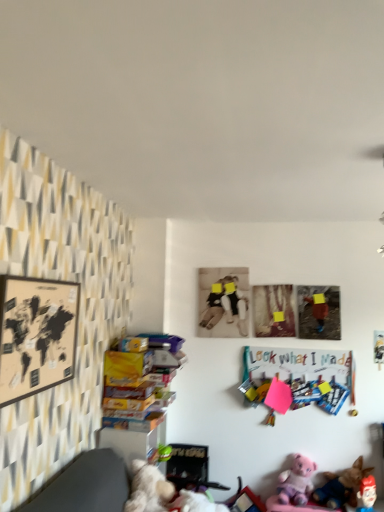
Question: From a real-world perspective, is pink plush bear at lower right, the 1th toy viewed from the back, physically below fluffy white teddy bear at lower center, acting as the 1th toy starting from the front?

Choices:
 (A) yes
 (B) no

Answer: (A)

Question: Is pink plush bear at lower right, the 1th toy viewed from the back, further to camera compared to fluffy white teddy bear at lower center, which is the 4th toy in back-to-front order?

Choices:
 (A) yes
 (B) no

Answer: (A)

Question: Is the position of pink plush bear at lower right, which appears as the fourth toy when viewed from the front, less distant than that of fluffy white teddy bear at lower center, the 1th toy when ordered from left to right?

Choices:
 (A) no
 (B) yes

Answer: (A)

Question: Can you confirm if pink plush bear at lower right, which is the 2th toy from left to right, is bigger than fluffy white teddy bear at lower center, which is the 4th toy in back-to-front order?

Choices:
 (A) no
 (B) yes

Answer: (A)

Question: From the image's perspective, does pink plush bear at lower right, the 1th toy viewed from the back, appear lower than fluffy white teddy bear at lower center, acting as the 1th toy starting from the front?

Choices:
 (A) yes
 (B) no

Answer: (A)

Question: Is fluffy white teddy bear at lower center, which is the 4th toy in back-to-front order, a part of pink plush bear at lower right, acting as the 3th toy starting from the right?

Choices:
 (A) no
 (B) yes

Answer: (A)

Question: From the image's perspective, is matte plastic picture frame at upper right, the 3th picture frame in the left-to-right sequence, above wooden map at left, which ranks as the first picture frame in front-to-back order?

Choices:
 (A) no
 (B) yes

Answer: (A)

Question: Is matte plastic picture frame at upper right, the 3th picture frame in the left-to-right sequence, to the left of wooden map at left, which ranks as the first picture frame in front-to-back order, from the viewer's perspective?

Choices:
 (A) no
 (B) yes

Answer: (A)

Question: Is matte plastic picture frame at upper right, the 3th picture frame in the left-to-right sequence, positioned before wooden map at left, the 3th picture frame positioned from the right?

Choices:
 (A) yes
 (B) no

Answer: (B)

Question: Does matte plastic picture frame at upper right, the first picture frame viewed from the right, have a lesser width compared to wooden map at left, the 3th picture frame positioned from the back?

Choices:
 (A) no
 (B) yes

Answer: (A)

Question: From the image's perspective, is matte plastic picture frame at upper right, which is the second picture frame in back-to-front order, beneath wooden map at left, the 3th picture frame positioned from the back?

Choices:
 (A) yes
 (B) no

Answer: (A)

Question: Is matte plastic picture frame at upper right, the second picture frame when ordered from front to back, next to wooden map at left, which is counted as the 1th picture frame, starting from the left?

Choices:
 (A) no
 (B) yes

Answer: (A)

Question: Could plush pink bear at lower right, the 4th toy from the left, be considered to be inside fluffy white teddy bear at lower center, the 1th toy when ordered from left to right?

Choices:
 (A) yes
 (B) no

Answer: (B)